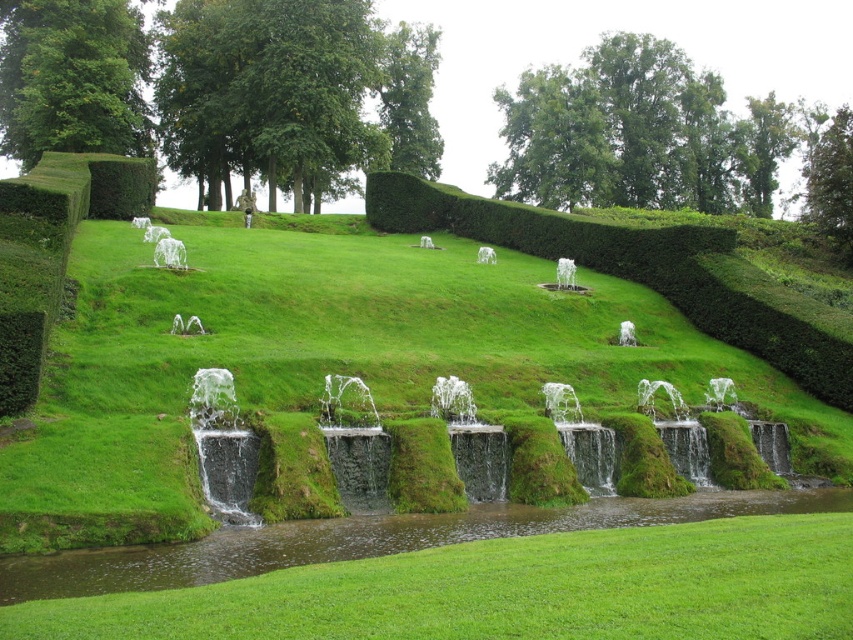
Is green mossy grass at center below green mossy stone at center?

No.

Is point (88, 227) farther from viewer compared to point (488, 497)?

Yes.

Describe the element at coordinates (328, 360) in the screenshot. I see `green mossy grass at center` at that location.

You are a GUI agent. You are given a task and a screenshot of the screen. Output one action in this format:
    pyautogui.click(x=<x>, y=<y>)
    Task: Click on the green mossy grass at center
    
    Given the screenshot: What is the action you would take?
    pyautogui.click(x=328, y=360)

Based on the photo, does green leafy hedge at upper center appear on the right side of green mossy stone at center?

Correct, you'll find green leafy hedge at upper center to the right of green mossy stone at center.

Locate an element on the screen. Image resolution: width=853 pixels, height=640 pixels. green leafy hedge at upper center is located at coordinates (646, 273).

Where is `green leafy hedge at upper center`? This screenshot has width=853, height=640. green leafy hedge at upper center is located at coordinates (646, 273).

Is green mossy stone at center further to camera compared to green leafy hedge at upper left?

No, green mossy stone at center is closer to the viewer.

Is point (599, 444) positioned in front of point (93, 164)?

Yes, it is.

Locate an element on the screen. This screenshot has height=640, width=853. green mossy stone at center is located at coordinates (223, 448).